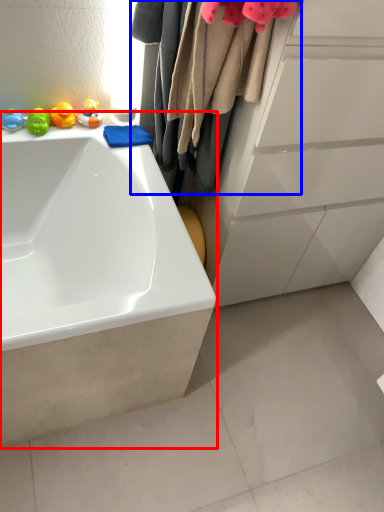
Question: Which object appears farthest to the camera in this image, bathtub (highlighted by a red box) or laundry (highlighted by a blue box)?

Choices:
 (A) bathtub
 (B) laundry

Answer: (A)